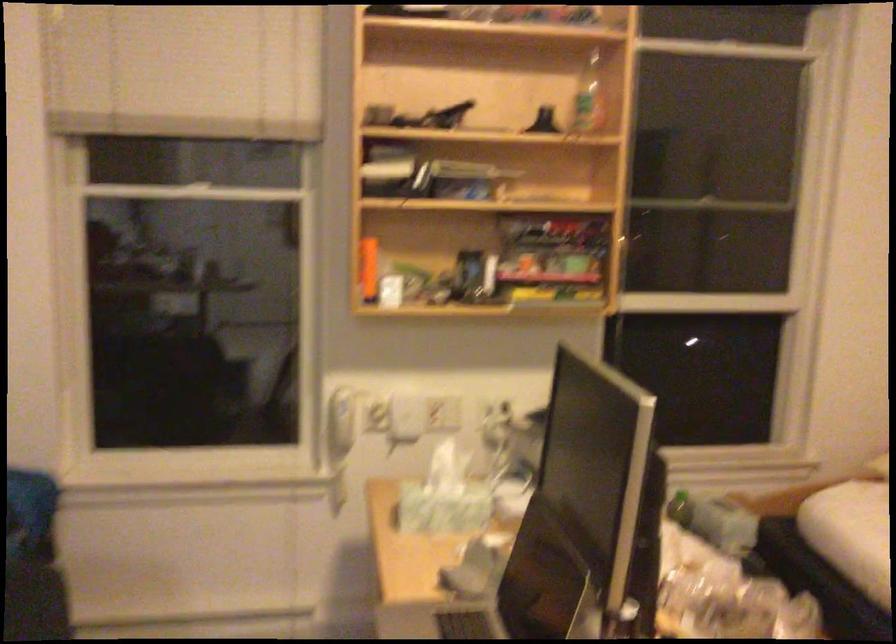
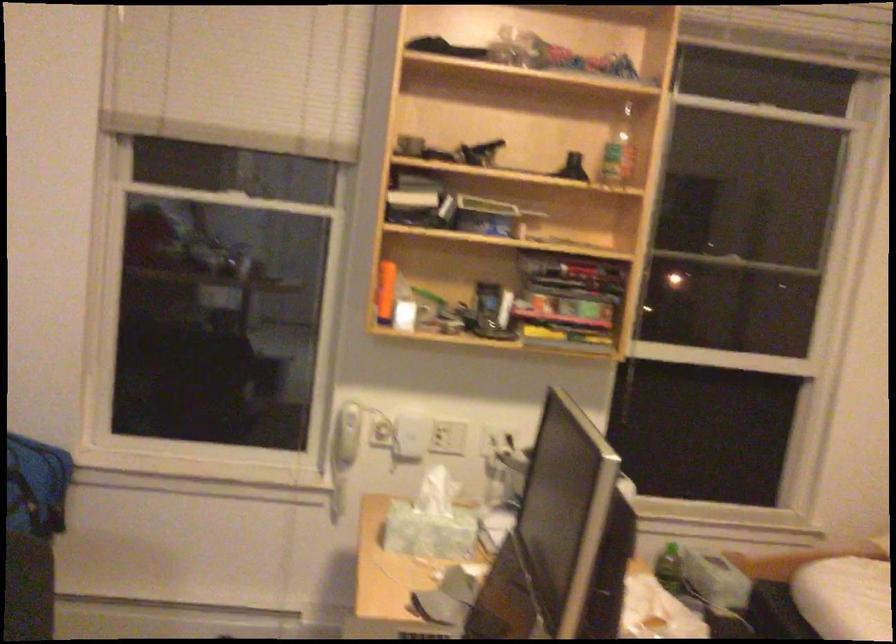
Locate, in the second image, the point that corresponds to point (369, 269) in the first image.

(384, 290)